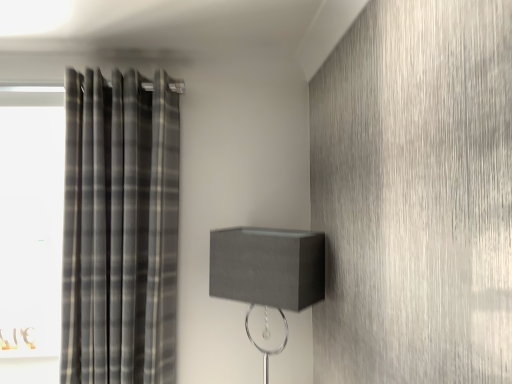
Question: From a real-world perspective, is plaid fabric curtain at left physically located above or below matte gray lampshade at center?

Choices:
 (A) below
 (B) above

Answer: (B)

Question: Is plaid fabric curtain at left in front of or behind matte gray lampshade at center in the image?

Choices:
 (A) behind
 (B) front

Answer: (A)

Question: Is plaid fabric curtain at left wider or thinner than matte gray lampshade at center?

Choices:
 (A) thin
 (B) wide

Answer: (A)

Question: In terms of height, does matte gray lampshade at center look taller or shorter compared to plaid fabric curtain at left?

Choices:
 (A) tall
 (B) short

Answer: (B)

Question: In the image, is matte gray lampshade at center on the left side or the right side of plaid fabric curtain at left?

Choices:
 (A) right
 (B) left

Answer: (A)

Question: Is point (305, 246) positioned closer to the camera than point (161, 370)?

Choices:
 (A) farther
 (B) closer

Answer: (B)

Question: Relative to plaid fabric curtain at left, is matte gray lampshade at center in front or behind?

Choices:
 (A) behind
 (B) front

Answer: (B)